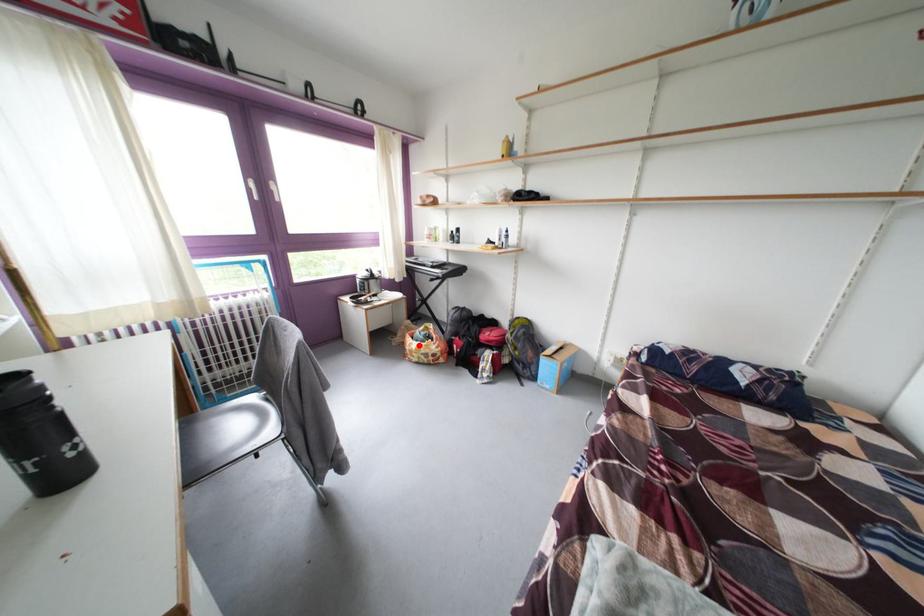
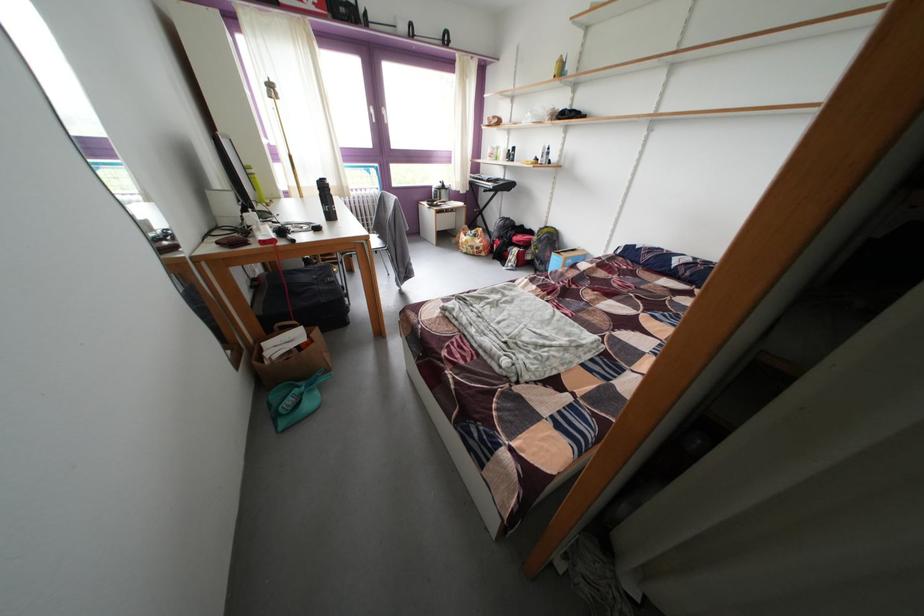
Where in the second image is the point corresponding to the highlighted location from the first image?

(472, 241)